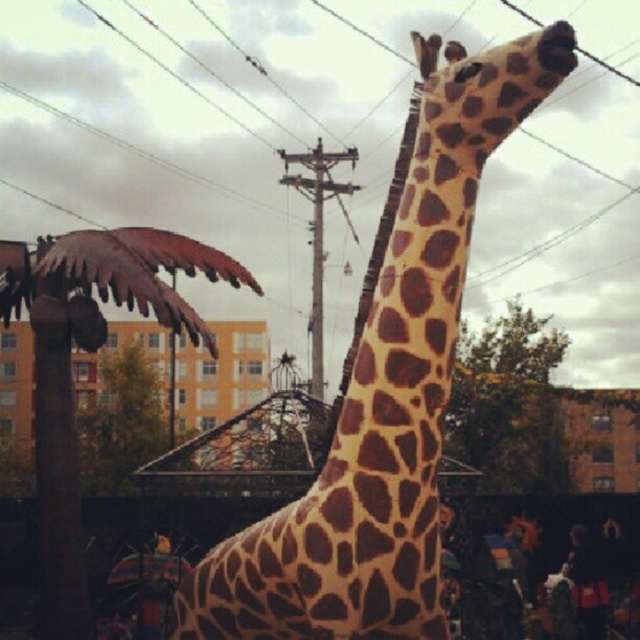
You are an urban planner assessing the spacing between the metallic brown palm tree at left and the green leafy tree at upper right. Which tree has a greater width?

The metallic brown palm tree at left has a greater width than the green leafy tree at upper right.

You are a city planner assessing the placement of sculptures in a public square. You need to ensure that the spotted fabric giraffe at center and the metallic brown palm tree at left are positioned so that the giraffe is taller than the palm tree. Based on the scene description, does the current arrangement meet this requirement?

Yes, the current arrangement meets the requirement because the spotted fabric giraffe at center is taller than the metallic brown palm tree at left according to the description.